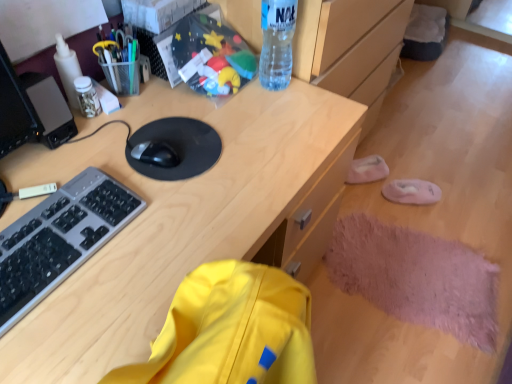
The width and height of the screenshot is (512, 384). I want to click on vacant area that lies between black matte mouse at center and metallic pen holder at upper left, positioned as the first stationery in right-to-left order, so click(x=146, y=120).